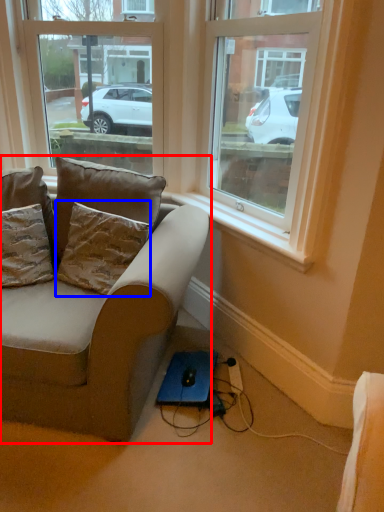
Question: Which object appears closest to the camera in this image, studio couch (highlighted by a red box) or pillow (highlighted by a blue box)?

Choices:
 (A) studio couch
 (B) pillow

Answer: (A)